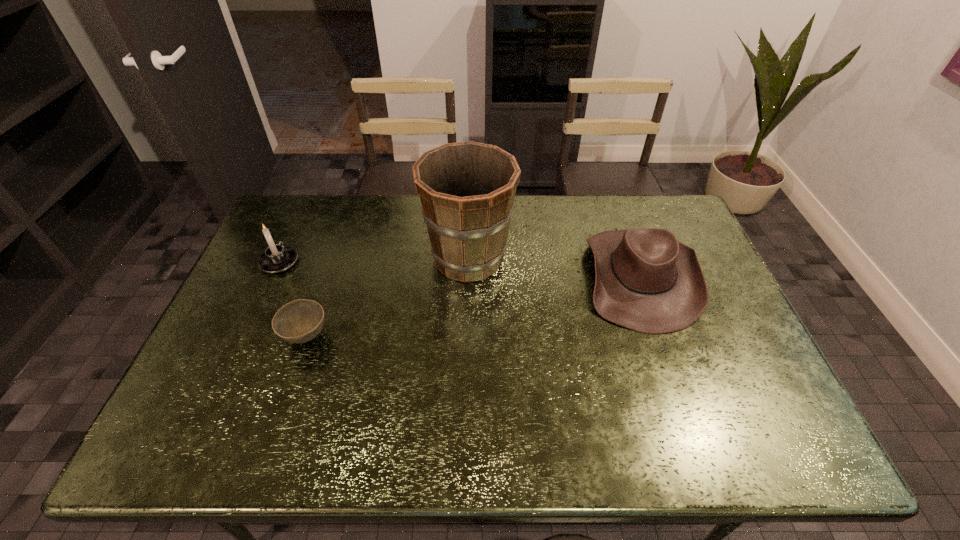
At what (x,y) coordinates should I click in order to perform the action: click on free space between the shortest object and the rightmost object. Please return your answer as a coordinate pair (x, y). This screenshot has height=540, width=960. Looking at the image, I should click on (474, 307).

Image resolution: width=960 pixels, height=540 pixels. In order to click on free space between the leftmost object and the tallest object in this screenshot , I will do `click(374, 260)`.

Identify which object is located as the nearest to the bucket. Please provide its 2D coordinates. Your answer should be formatted as a tuple, i.e. [(x, y)], where the tuple contains the x and y coordinates of a point satisfying the conditions above.

[(646, 280)]

This screenshot has height=540, width=960. In order to click on object identified as the second closest to the tallest object in this screenshot , I will do (x=299, y=321).

The image size is (960, 540). What are the coordinates of `vacant space that satisfies the following two spatial constraints: 1. with a handle on the side of the tallest object; 2. on the left side of the candle holder` in the screenshot? It's located at (281, 258).

In order to click on vacant space that satisfies the following two spatial constraints: 1. with a handle on the side of the leftmost object; 2. on the right side of the tallest object in this screenshot , I will do `click(281, 258)`.

Identify the location of vacant space that satisfies the following two spatial constraints: 1. with a handle on the side of the tallest object; 2. on the left side of the candle holder. The width and height of the screenshot is (960, 540). (281, 258).